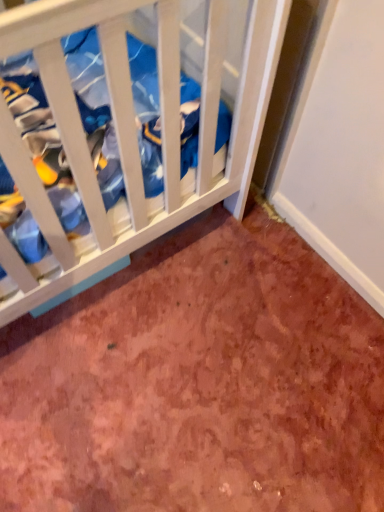
This screenshot has height=512, width=384. In order to click on vacant point above brown textured carpet at lower center (from a real-world perspective) in this screenshot , I will do `click(183, 357)`.